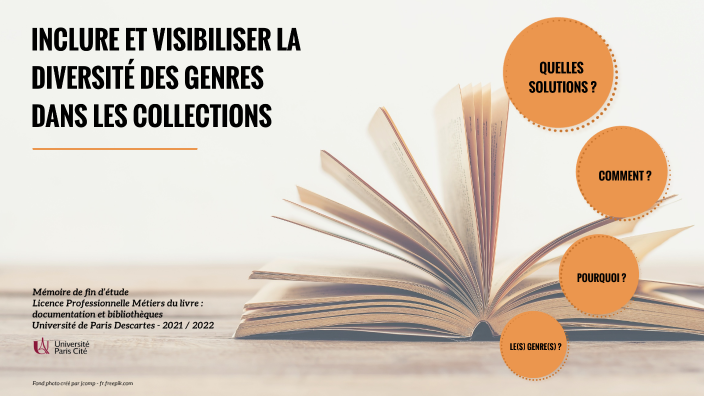
At what (x,y) coordinates should I click in order to perform the action: click on wall. Please return your answer as a coordinate pair (x, y). Looking at the image, I should click on (253, 200).